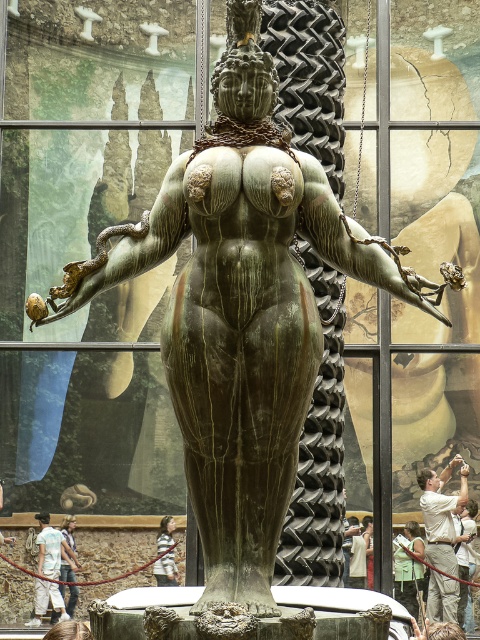
Is white cotton shirt at lower right taller than light brown wooden stick at lower center?

Indeed, white cotton shirt at lower right has a greater height compared to light brown wooden stick at lower center.

The height and width of the screenshot is (640, 480). In order to click on white cotton shirt at lower right in this screenshot , I will do `click(442, 513)`.

Can you confirm if white cotton shirt at lower right is positioned to the left of denim jacket at lower left?

Incorrect, white cotton shirt at lower right is not on the left side of denim jacket at lower left.

Can you confirm if white cotton shirt at lower right is smaller than denim jacket at lower left?

Actually, white cotton shirt at lower right might be larger than denim jacket at lower left.

Between point (431, 609) and point (60, 561), which one is positioned in front?

Positioned in front is point (431, 609).

I want to click on white cotton shirt at lower right, so click(x=442, y=513).

Does light blue denim jeans at lower left have a lesser height compared to denim jacket at lower left?

No, light blue denim jeans at lower left is not shorter than denim jacket at lower left.

Who is more distant from viewer, (40, 536) or (78, 588)?

The point (78, 588) is more distant.

At what (x,y) coordinates should I click in order to perform the action: click on light blue denim jeans at lower left. Please return your answer as a coordinate pair (x, y). Looking at the image, I should click on (48, 570).